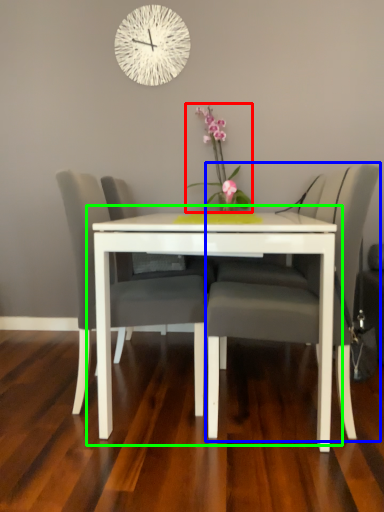
Question: Which object is the farthest from floral arrangement (highlighted by a red box)? Choose among these: chair (highlighted by a blue box) or table (highlighted by a green box).

Choices:
 (A) chair
 (B) table

Answer: (B)